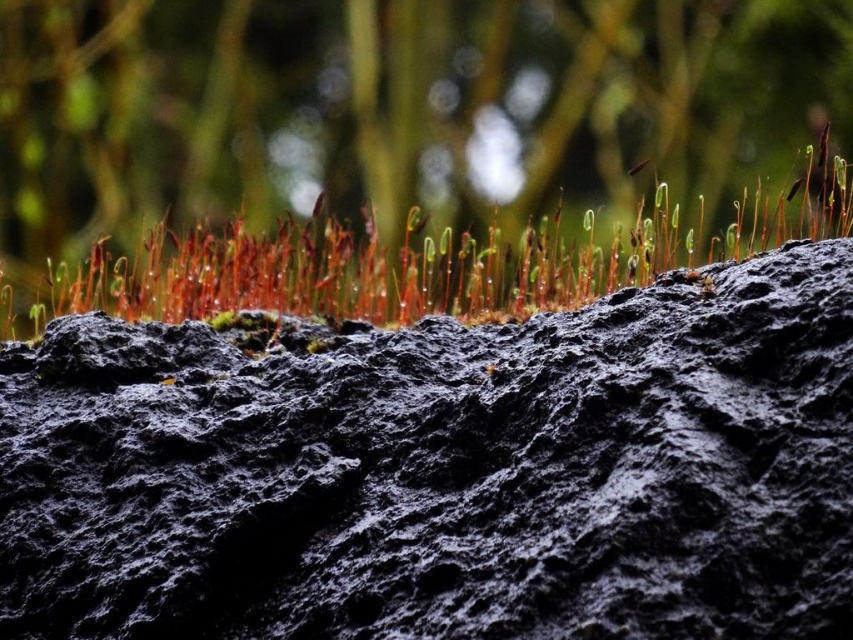
Question: Does black rough rock at upper center have a smaller size compared to green matte grass at upper center?

Choices:
 (A) yes
 (B) no

Answer: (B)

Question: Is black rough rock at upper center wider than green matte grass at upper center?

Choices:
 (A) no
 (B) yes

Answer: (A)

Question: Does black rough rock at upper center appear on the left side of green matte grass at upper center?

Choices:
 (A) no
 (B) yes

Answer: (B)

Question: Which point is farther to the camera?

Choices:
 (A) green matte grass at upper center
 (B) black rough rock at upper center

Answer: (A)